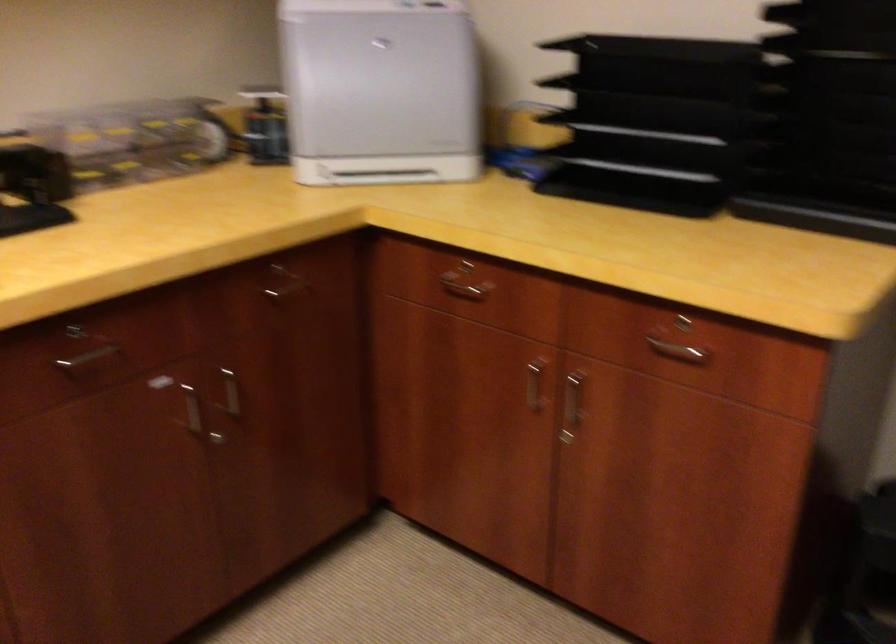
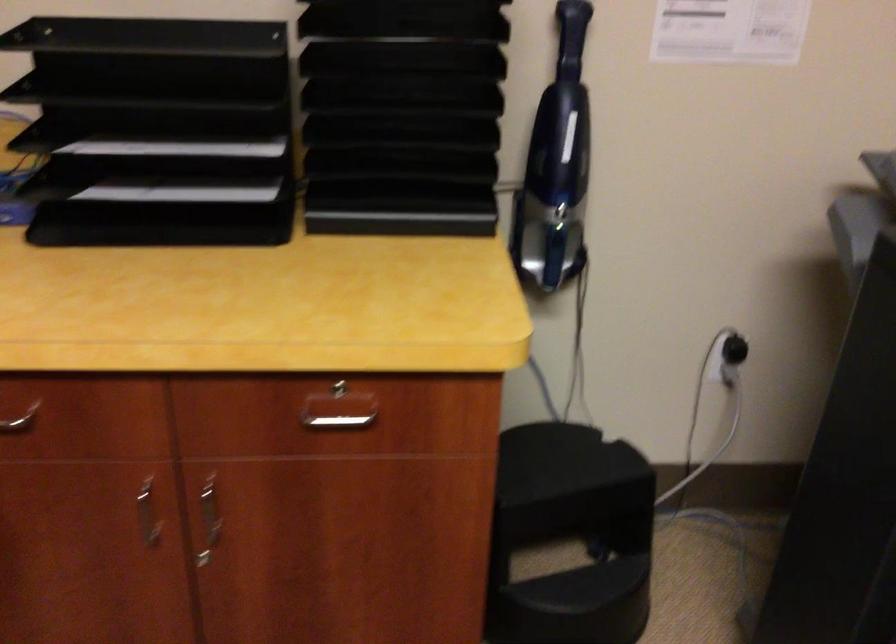
The point at (691,328) is marked in the first image. Where is the corresponding point in the second image?

(342, 391)